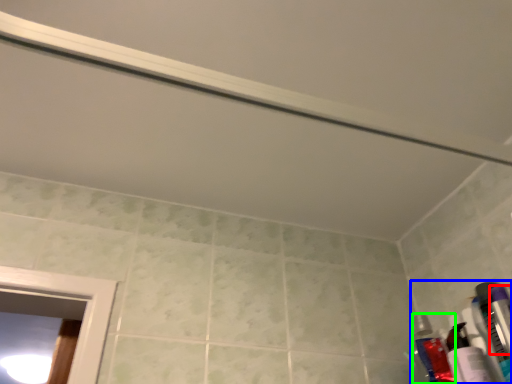
Question: Based on their relative distances, which object is nearer to toiletry (highlighted by a red box)? Choose from toiletry (highlighted by a blue box) and toiletry (highlighted by a green box).

Choices:
 (A) toiletry
 (B) toiletry

Answer: (A)